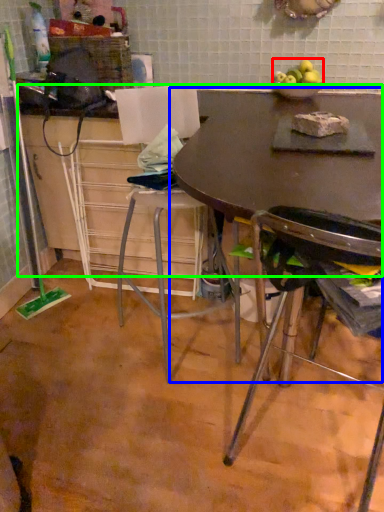
Question: Based on their relative distances, which object is nearer to apple (highlighted by a red box)? Choose from table (highlighted by a blue box) and counter top (highlighted by a green box).

Choices:
 (A) table
 (B) counter top

Answer: (B)